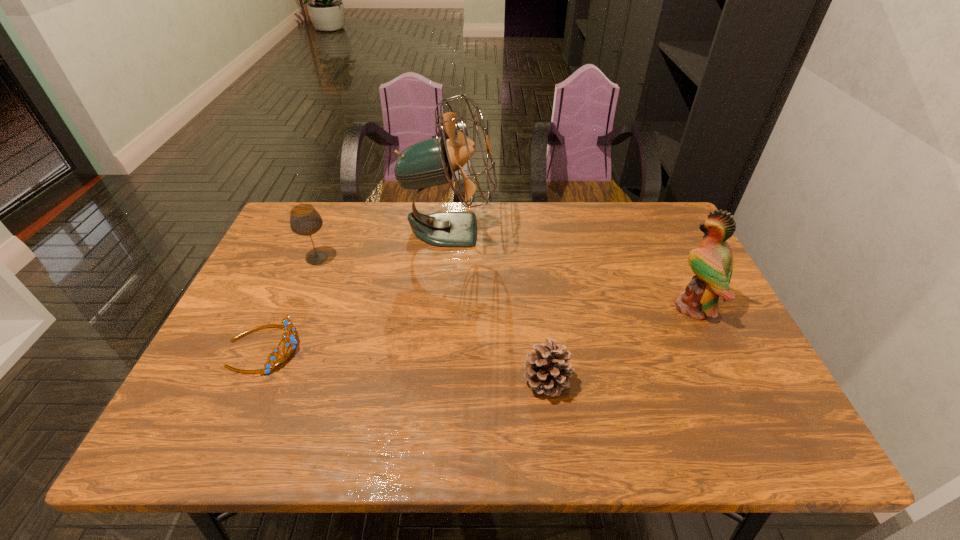
The image size is (960, 540). I want to click on vacant area located 0.130m on the front-facing side of the rightmost object, so click(x=621, y=307).

Where is `vacant area situated on the front-facing side of the rightmost object`? Image resolution: width=960 pixels, height=540 pixels. vacant area situated on the front-facing side of the rightmost object is located at coordinates (569, 307).

At what (x,y) coordinates should I click in order to perform the action: click on vacant space located on the right of the third tallest object. Please return your answer as a coordinate pair (x, y). Looking at the image, I should click on (416, 258).

Find the location of `blank area located on the left of the second object from right to left`. blank area located on the left of the second object from right to left is located at coordinates (453, 381).

Where is `free space located on the front-facing side of the shortest object`? This screenshot has width=960, height=540. free space located on the front-facing side of the shortest object is located at coordinates (406, 348).

Where is `fan at the far edge`? This screenshot has height=540, width=960. fan at the far edge is located at coordinates (432, 162).

Locate an element on the screen. This screenshot has width=960, height=540. wineglass present at the far edge is located at coordinates (304, 219).

Locate an element on the screen. The width and height of the screenshot is (960, 540). wineglass at the left edge is located at coordinates (304, 219).

The image size is (960, 540). What are the coordinates of `tiara that is at the left edge` in the screenshot? It's located at (287, 325).

Identify the location of object that is at the right edge. (712, 263).